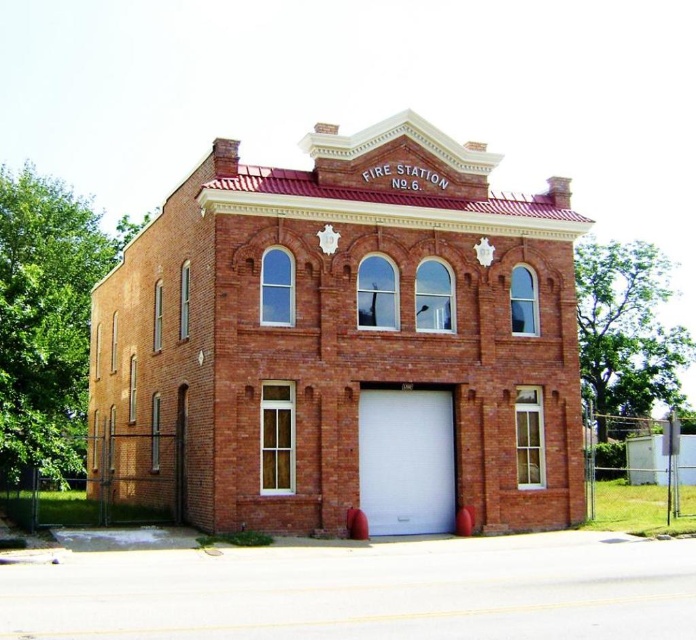
Consider the image. You are a firefighter standing at the entrance of Fire Station No. 6. You notice two points marked on the building facade. The first point is at coordinates point (351, 374) and the second is at point (425, 456). Which point is closer to you?

Point (351, 374) is in front of point (425, 456), so it is closer to you.